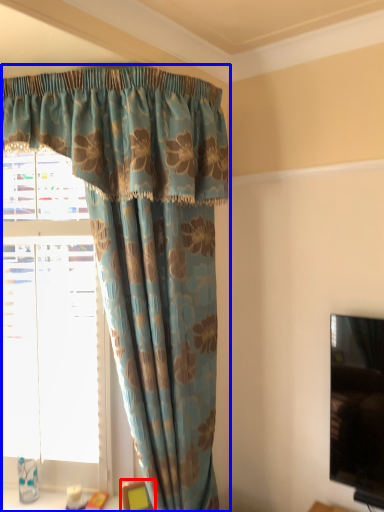
Question: Which point is closer to the camera, furniture (highlighted by a red box) or curtain (highlighted by a blue box)?

Choices:
 (A) furniture
 (B) curtain

Answer: (B)